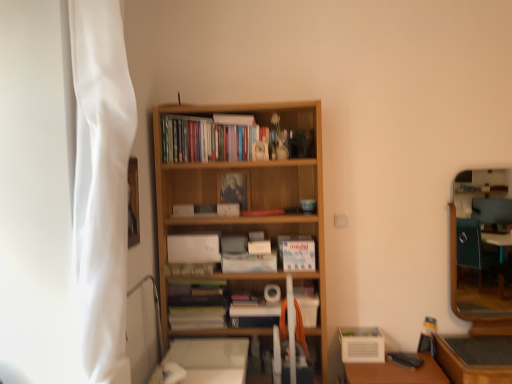
What are the coordinates of `free point above wooden table at lower right (from a real-world perspective)` in the screenshot? It's located at (399, 368).